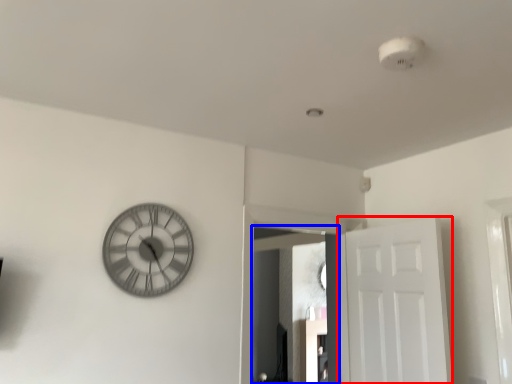
Question: Which of the following is the farthest to the observer, door (highlighted by a red box) or mirror (highlighted by a blue box)?

Choices:
 (A) door
 (B) mirror

Answer: (B)